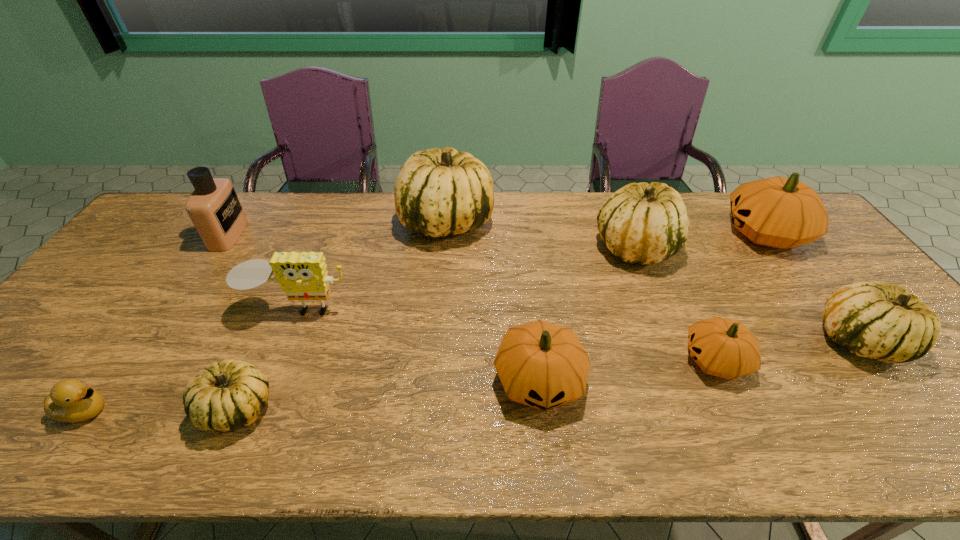
You are a GUI agent. You are given a task and a screenshot of the screen. Output one action in this format:
    pyautogui.click(x=<x>, y=<y>)
    Task: Click on the smallest white gourd
    The image size is (960, 540).
    Given the screenshot: What is the action you would take?
    pyautogui.click(x=224, y=396)

Where is `the leftmost gourd`? the leftmost gourd is located at coordinates (224, 396).

This screenshot has width=960, height=540. I want to click on duckling, so click(71, 401).

Identify the location of vacant space situated 0.380m on the right of the biggest white gourd. (608, 221).

The image size is (960, 540). In order to click on vacant space situated 0.330m on the front label of the beige perfume in this screenshot , I will do `click(345, 235)`.

This screenshot has width=960, height=540. Find the location of `vacant space positioned on the side of the biggest orange gourd with the carved face`. vacant space positioned on the side of the biggest orange gourd with the carved face is located at coordinates (663, 233).

You are a GUI agent. You are given a task and a screenshot of the screen. Output one action in this format:
    pyautogui.click(x=<x>, y=<y>)
    Task: Click on the vacant point located on the side of the biggest orange gourd with the carved face
    The width and height of the screenshot is (960, 540).
    Given the screenshot: What is the action you would take?
    [x=608, y=233]

You are a GUI agent. You are given a task and a screenshot of the screen. Output one action in this format:
    pyautogui.click(x=<x>, y=<y>)
    Task: Click on the free point located 0.120m on the side of the biggest orange gourd with the carved face
    This screenshot has width=960, height=540.
    Given the screenshot: What is the action you would take?
    pyautogui.click(x=685, y=233)

The image size is (960, 540). Find the location of `blank space located on the right of the third white gourd from left to right`. blank space located on the right of the third white gourd from left to right is located at coordinates click(732, 246).

In order to click on free spot located 0.130m on the front-facing side of the yellow sponge in this screenshot , I will do `click(276, 366)`.